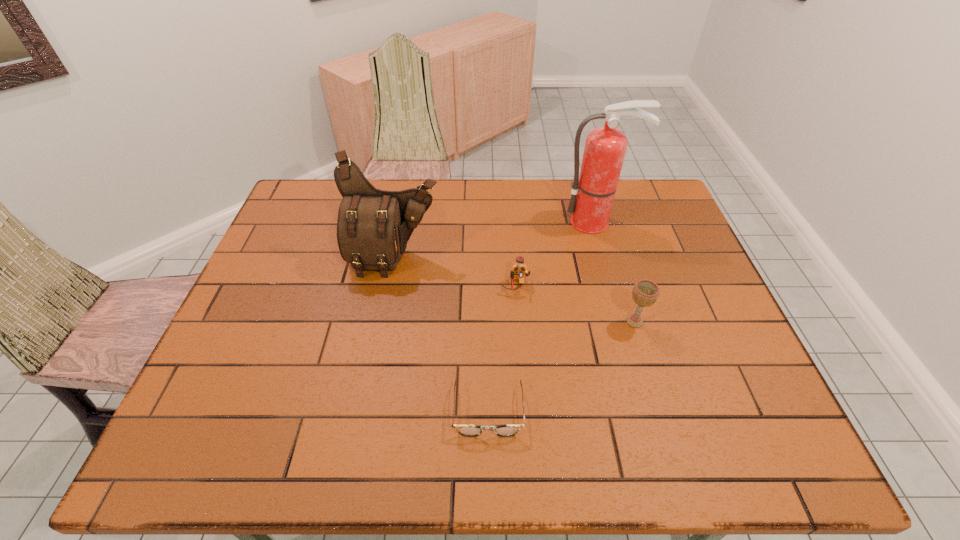
Find the location of a particular element. The width and height of the screenshot is (960, 540). free space located on the front-facing side of the second tallest object is located at coordinates (371, 380).

I want to click on vacant position located on the left of the third tallest object, so click(x=556, y=322).

What are the coordinates of `free space located 0.370m holding a crossbow in the hands of the Lego` in the screenshot? It's located at (527, 427).

Locate an element on the screen. This screenshot has width=960, height=540. object situated at the far edge is located at coordinates coord(593,191).

Where is `object situated at the near edge`? The height and width of the screenshot is (540, 960). object situated at the near edge is located at coordinates (465, 430).

I want to click on object present at the right edge, so click(x=593, y=191).

Where is `object located in the far right corner section of the desktop`? The height and width of the screenshot is (540, 960). object located in the far right corner section of the desktop is located at coordinates (593, 191).

What are the coordinates of `vacant region at the far edge of the desktop` in the screenshot? It's located at (519, 219).

Identify the location of vacant space at the near edge. (490, 464).

This screenshot has width=960, height=540. I want to click on blank space at the left edge of the desktop, so click(x=254, y=298).